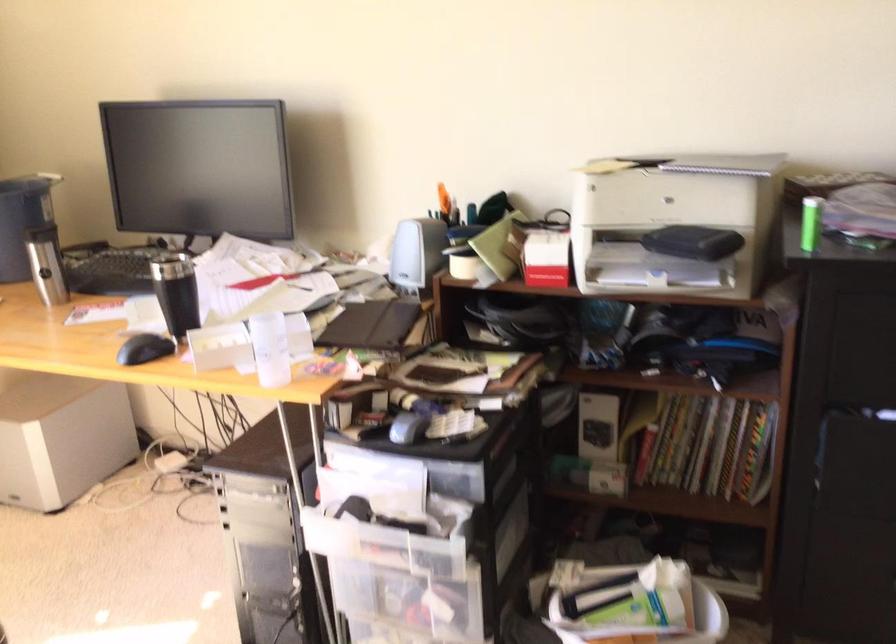
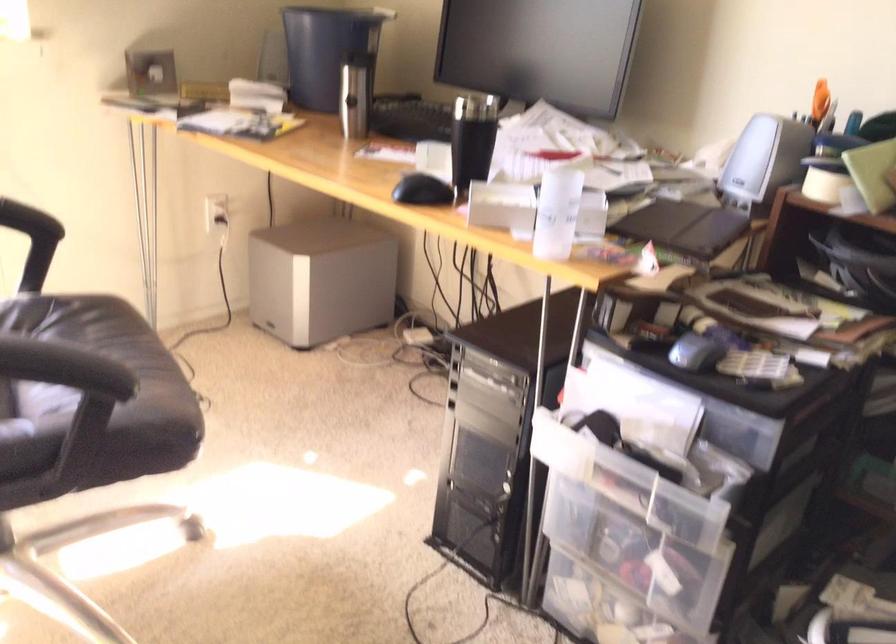
Find the pixel in the second image that matches [375,325] in the first image.

(684, 227)